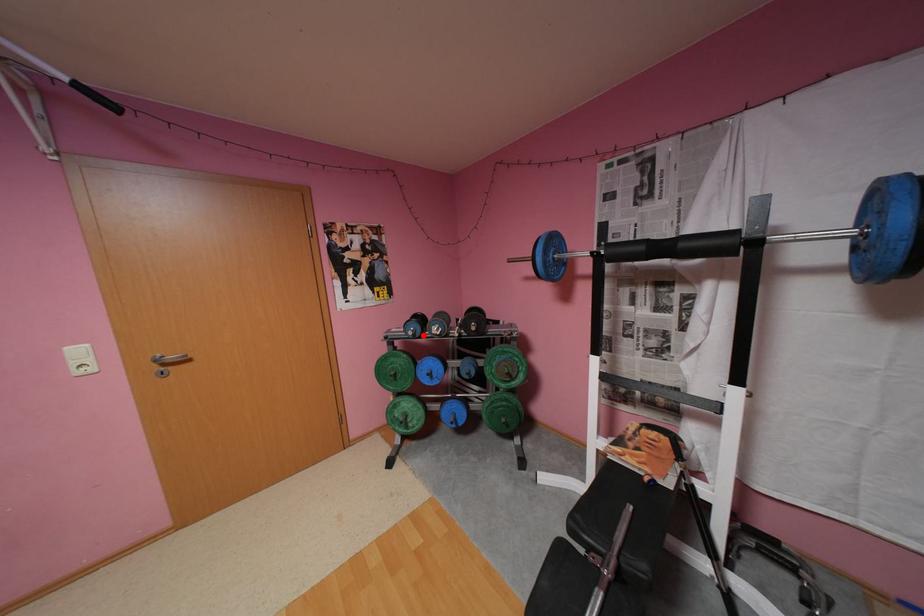
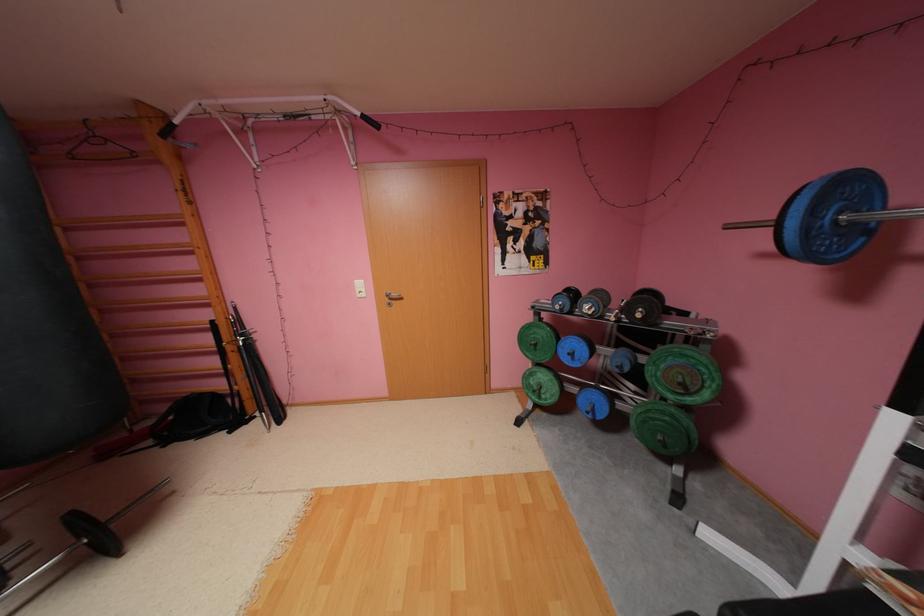
Question: A red point is marked in image1. In image2, is the corresponding 3D point closer to the camera or farther? Reply with the corresponding letter.

Choices:
 (A) The corresponding 3D point is closer.
 (B) The corresponding 3D point is farther.

Answer: (A)